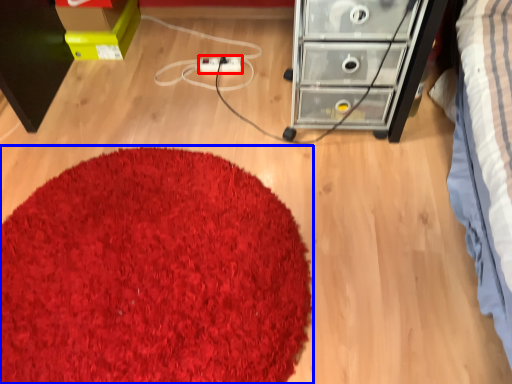
Question: Which of the following is the farthest to the observer, extension cord (highlighted by a red box) or mat (highlighted by a blue box)?

Choices:
 (A) extension cord
 (B) mat

Answer: (A)